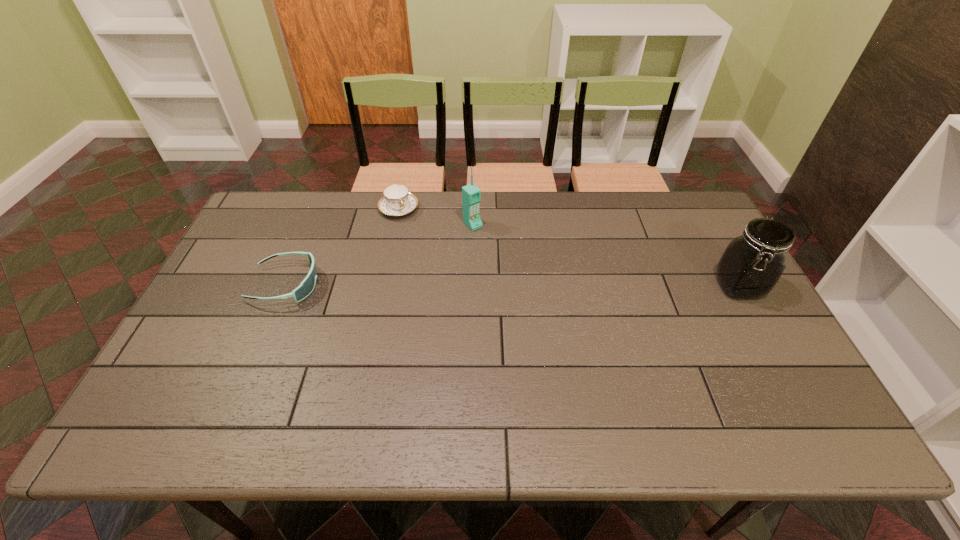
The width and height of the screenshot is (960, 540). In order to click on vacant area between the goggles and the third object from left to right in this screenshot , I will do `click(379, 254)`.

Find the location of a particular element. The width and height of the screenshot is (960, 540). free area in between the rightmost object and the teacup is located at coordinates (568, 248).

At what (x,y) coordinates should I click in order to perform the action: click on the closest object to the second object from left to right. Please return your answer as a coordinate pair (x, y). The width and height of the screenshot is (960, 540). Looking at the image, I should click on (471, 195).

Where is `object that can be found as the closest to the teacup`? This screenshot has height=540, width=960. object that can be found as the closest to the teacup is located at coordinates (x=471, y=195).